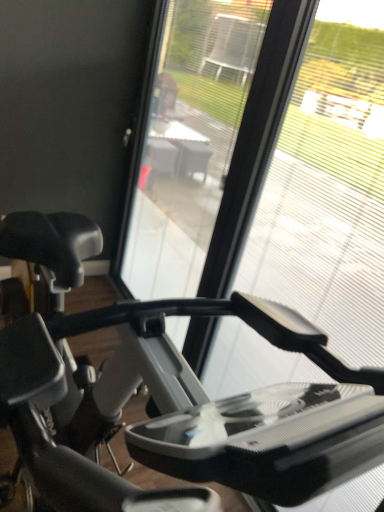
Question: Based on their sizes in the image, would you say matte black stationary bicycle at left is bigger or smaller than transparent plastic glass at center?

Choices:
 (A) small
 (B) big

Answer: (B)

Question: Considering the relative positions of matte black stationary bicycle at left and transparent plastic glass at center in the image provided, is matte black stationary bicycle at left to the left or to the right of transparent plastic glass at center?

Choices:
 (A) left
 (B) right

Answer: (A)

Question: Which is nearer to the transparent plastic glass at center?

Choices:
 (A) transparent plastic screen door at center
 (B) matte black stationary bicycle at left

Answer: (A)

Question: Which object is the farthest from the transparent plastic glass at center?

Choices:
 (A) transparent plastic screen door at center
 (B) matte black stationary bicycle at left

Answer: (B)